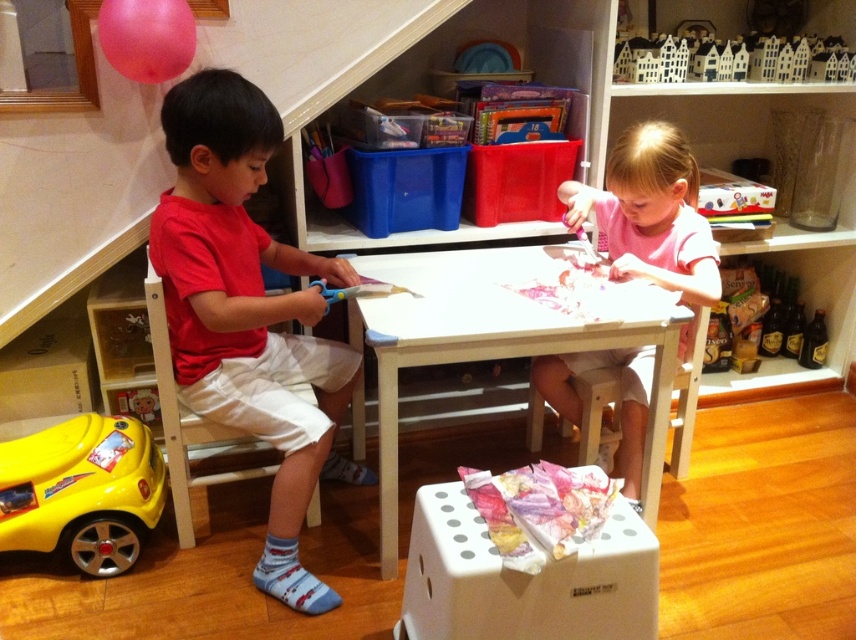
You are a child sitting at the small white table and want to reach the yellow plastic toy car at lower left. Based on the coordinates provided, can you estimate how far the toy car is from the edge of the table?

The yellow plastic toy car at lower left is positioned at coordinates point (82, 490), which means it is very close to the edge of the table, so you can easily reach it without moving your chair.

Consider the image. You are a child who wants to reach the pink rubber balloon at upper left from your current position near the red matte shirt at left. Can you easily grab it without moving your chair?

The red matte shirt at left is 16.92 inches away from the pink rubber balloon at upper left. Since the distance is less than 2 feet, you can easily grab the pink rubber balloon at upper left without moving your chair.